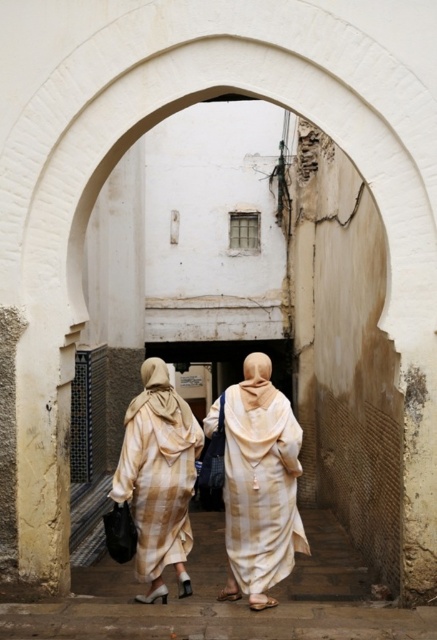
Question: Observing the image, what is the correct spatial positioning of beige cotton dress at center in reference to beige striped robe at center?

Choices:
 (A) above
 (B) below

Answer: (A)

Question: Which of the following is the closest to the observer?

Choices:
 (A) beige cotton dress at center
 (B) beige striped robe at center

Answer: (A)

Question: Does beige cotton dress at center have a smaller size compared to beige striped robe at center?

Choices:
 (A) no
 (B) yes

Answer: (B)

Question: Does beige cotton dress at center have a greater width compared to beige striped robe at center?

Choices:
 (A) yes
 (B) no

Answer: (B)

Question: Which of the following is the farthest from the observer?

Choices:
 (A) (243, 564)
 (B) (141, 522)

Answer: (B)